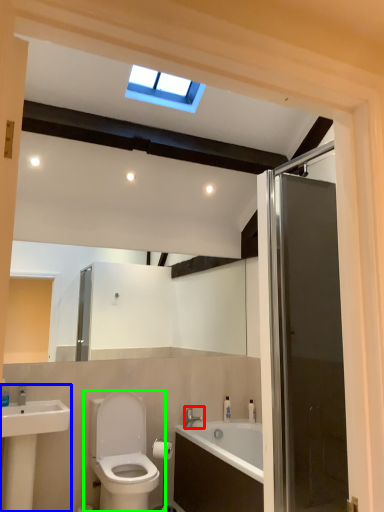
Question: Which object is positioned farthest from tap (highlighted by a red box)? Select from sink (highlighted by a blue box) and toilet (highlighted by a green box).

Choices:
 (A) sink
 (B) toilet

Answer: (A)